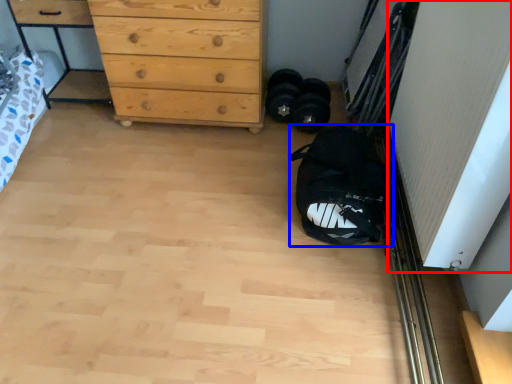
Question: Which of the following is the closest to the observer, screen door (highlighted by a red box) or sack (highlighted by a blue box)?

Choices:
 (A) screen door
 (B) sack

Answer: (A)